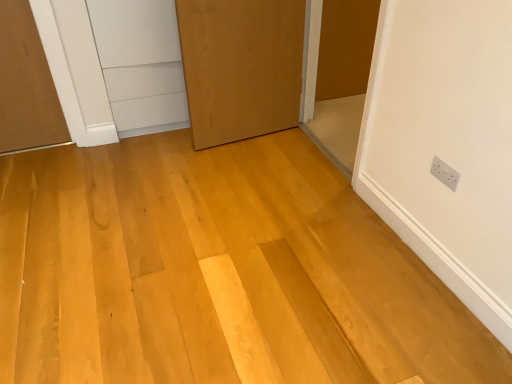
The width and height of the screenshot is (512, 384). I want to click on vacant space in front of wooden door at center, arranged as the 2th door when viewed from the right, so click(221, 168).